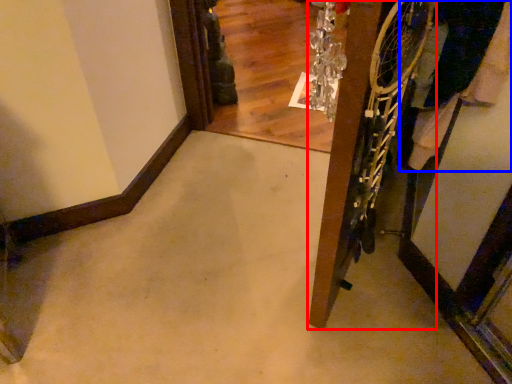
Question: Which point is further to the camera, door (highlighted by a red box) or clothing (highlighted by a blue box)?

Choices:
 (A) door
 (B) clothing

Answer: (B)